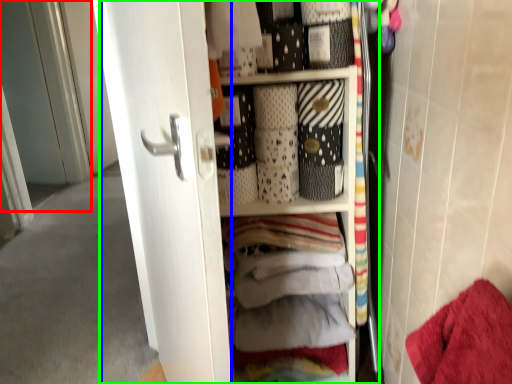
Question: Which is nearer to the screen door (highlighted by a red box)? screen door (highlighted by a blue box) or dresser (highlighted by a green box).

Choices:
 (A) screen door
 (B) dresser

Answer: (A)